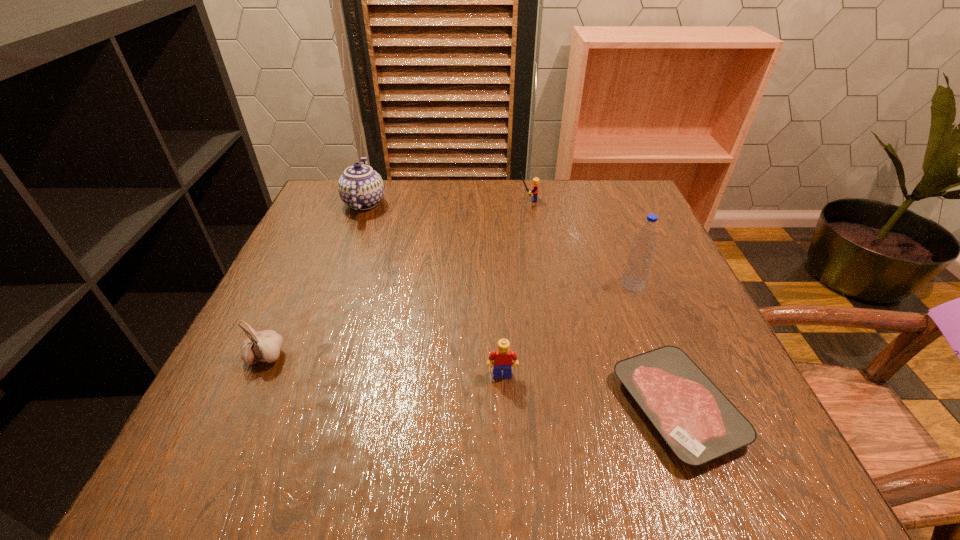
Identify the location of free space located at the spout of the second tallest object. The height and width of the screenshot is (540, 960). (531, 203).

Find the location of `free point located 0.210m on the front-facing side of the farther Lego`. free point located 0.210m on the front-facing side of the farther Lego is located at coordinates (439, 200).

This screenshot has width=960, height=540. Identify the location of free space located 0.190m on the front-facing side of the farther Lego. (446, 200).

I want to click on vacant position located 0.300m on the front-facing side of the farther Lego, so click(x=404, y=200).

The width and height of the screenshot is (960, 540). I want to click on vacant position located on the face of the left Lego, so 507,467.

Locate an element on the screen. The height and width of the screenshot is (540, 960). blank space located on the back of the garlic is located at coordinates (293, 299).

The height and width of the screenshot is (540, 960). What are the coordinates of `vacant space located on the back of the steak` in the screenshot? It's located at (637, 307).

Find the location of a particular element. This screenshot has height=540, width=960. chinaware that is at the far edge is located at coordinates (360, 187).

The height and width of the screenshot is (540, 960). Find the location of `Lego that is positioned at the far edge`. Lego that is positioned at the far edge is located at coordinates (535, 187).

I want to click on object that is at the near edge, so click(x=699, y=423).